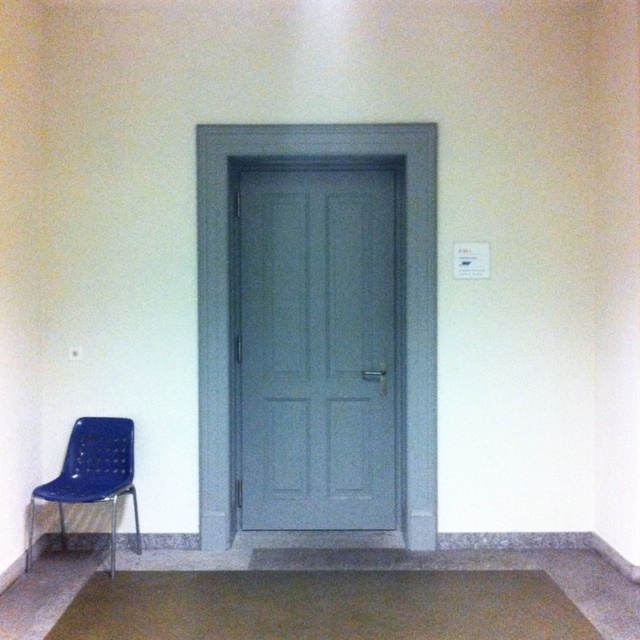
Looking at this image, does brown textured mat at lower center come behind blue plastic chair at lower left?

That is False.

Does point (56, 628) come farther from viewer compared to point (88, 428)?

No, it is in front of (88, 428).

Is point (131, 600) closer to camera compared to point (134, 534)?

Yes, it is.

Where is `brown textured mat at lower center`? The width and height of the screenshot is (640, 640). brown textured mat at lower center is located at coordinates (323, 605).

Is matte gray door at center below blue plastic chair at lower left?

Actually, matte gray door at center is above blue plastic chair at lower left.

Does matte gray door at center lie in front of blue plastic chair at lower left?

That is False.

Does point (294, 168) lie behind point (72, 464)?

Yes, it is.

I want to click on matte gray door at center, so [316, 348].

Is matte gray door at center to the right of brown textured mat at lower center from the viewer's perspective?

Incorrect, matte gray door at center is not on the right side of brown textured mat at lower center.

Who is taller, matte gray door at center or brown textured mat at lower center?

With more height is matte gray door at center.

Who is more distant from viewer, (x=236, y=342) or (x=529, y=586)?

Point (x=236, y=342)

Image resolution: width=640 pixels, height=640 pixels. I want to click on matte gray door at center, so click(316, 348).